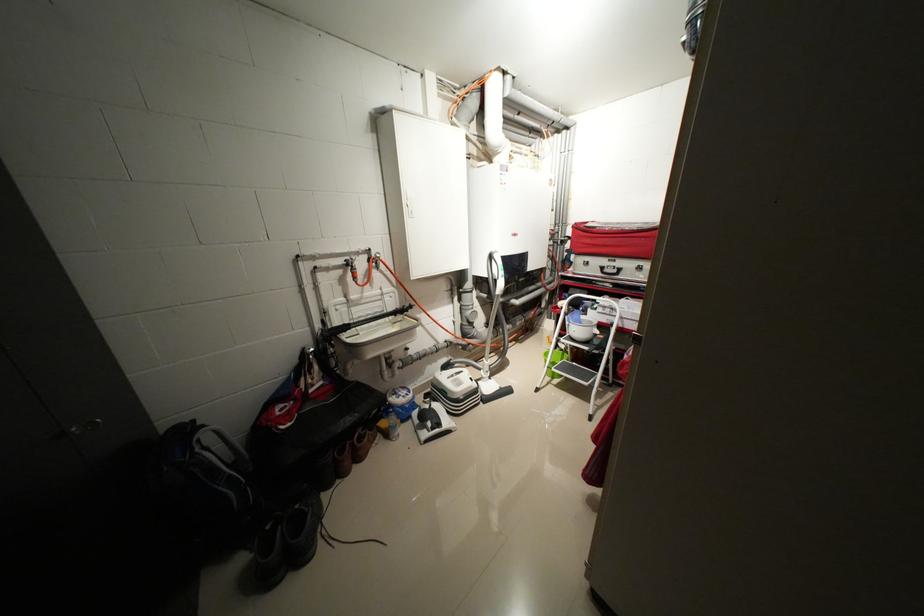
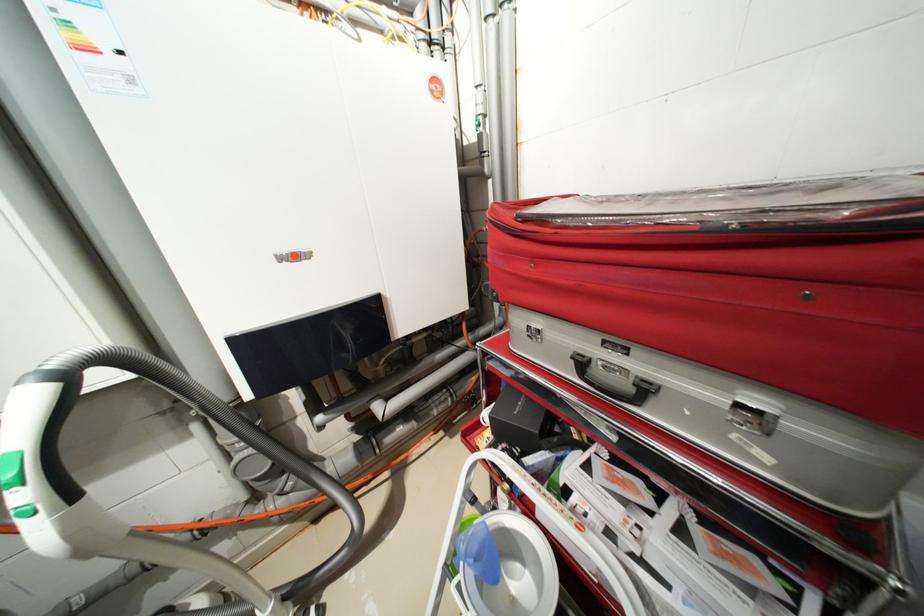
The images are taken continuously from a first-person perspective. In which direction are you moving?

The cameraman walked toward right, forward.